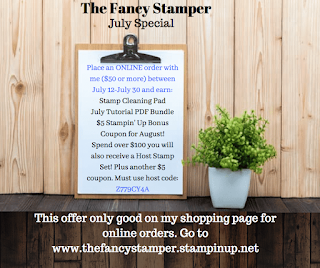
Where is `counter`? This screenshot has width=320, height=268. counter is located at coordinates (127, 204).